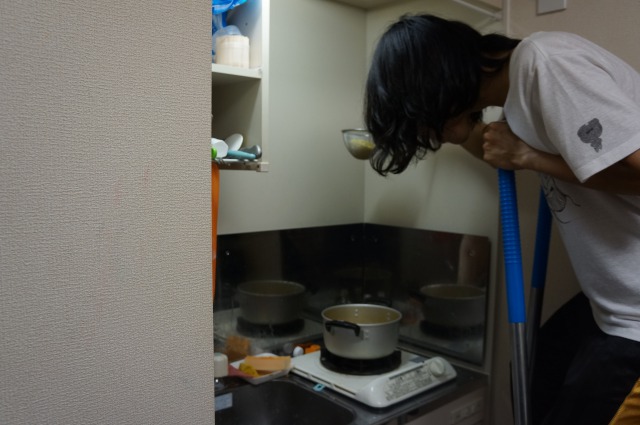
Where is `wall`? The height and width of the screenshot is (425, 640). wall is located at coordinates (319, 133), (449, 186).